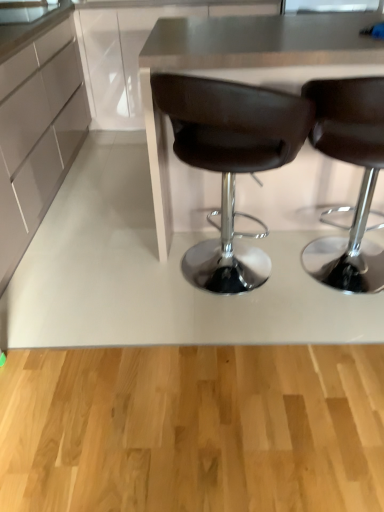
Where is `vacant space in front of metallic gray table at center`? The height and width of the screenshot is (512, 384). vacant space in front of metallic gray table at center is located at coordinates (236, 376).